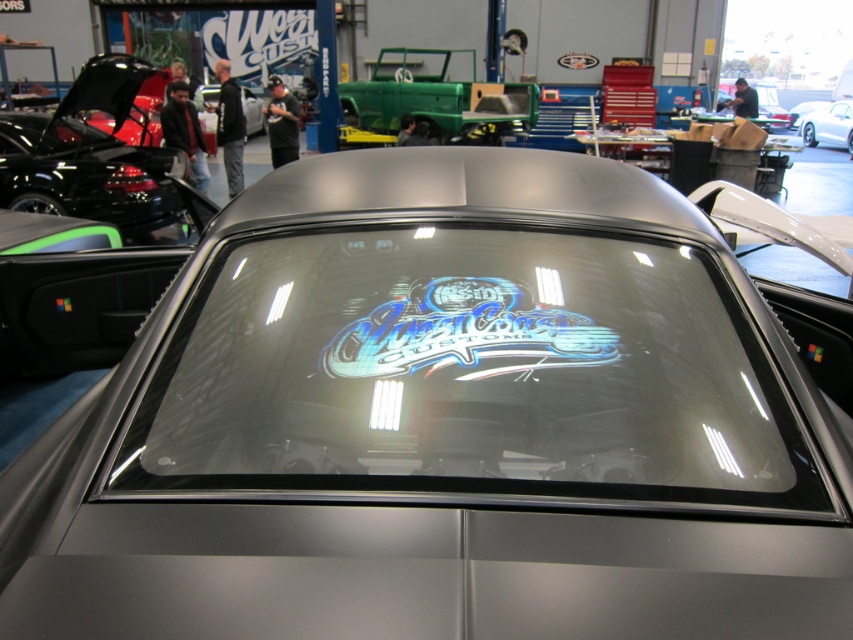
Question: Which point appears closest to the camera in this image?

Choices:
 (A) (119, 200)
 (B) (387, 440)
 (C) (822, 106)

Answer: (B)

Question: Which object is farther from the camera taking this photo?

Choices:
 (A) satin silver car at center
 (B) transparent glass windshield at center

Answer: (A)

Question: Can you confirm if transparent glass windshield at center is positioned to the right of satin silver car at center?

Choices:
 (A) yes
 (B) no

Answer: (B)

Question: Which point is closer to the camera taking this photo?

Choices:
 (A) (422, 340)
 (B) (637, 237)
 (C) (161, 192)

Answer: (A)

Question: Does transparent glass windshield at center have a smaller size compared to matte black car at center?

Choices:
 (A) yes
 (B) no

Answer: (A)

Question: Can you confirm if matte black car at left is positioned to the left of satin silver car at center?

Choices:
 (A) no
 (B) yes

Answer: (B)